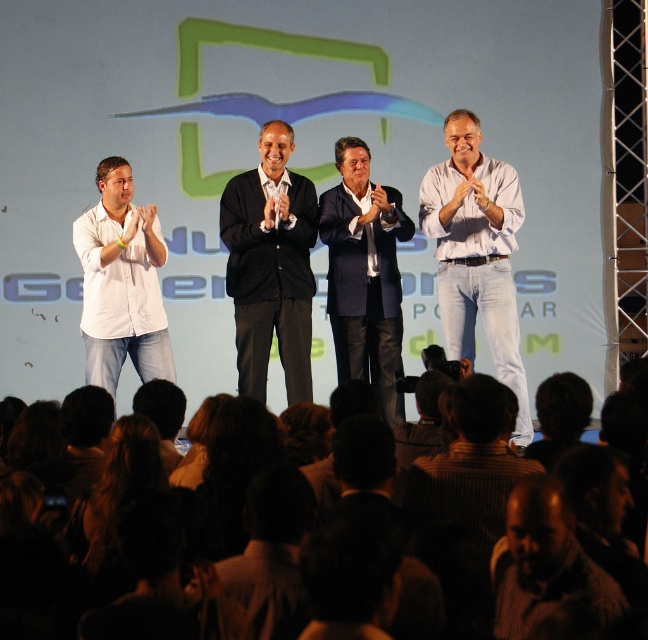
Which is above, white matte shirt at left or striped shirt at lower right?

white matte shirt at left is higher up.

Measure the distance between point (143,378) and camera.

6.16 meters

Is point (145, 324) in front of point (533, 605)?

No, it is not.

Find the location of `white matte shirt at left`. white matte shirt at left is located at coordinates (121, 282).

Does black cardigan at center have a greater height compared to white matte shirt at left?

Yes.

Based on the photo, can you confirm if black cardigan at center is positioned to the left of white matte shirt at left?

Incorrect, black cardigan at center is not on the left side of white matte shirt at left.

Is point (240, 262) positioned before point (76, 225)?

No, (240, 262) is further to viewer.

Locate an element on the screen. The width and height of the screenshot is (648, 640). black cardigan at center is located at coordinates (270, 266).

Can you confirm if navy blue suit at center is thinner than white matte shirt at left?

Yes, navy blue suit at center is thinner than white matte shirt at left.

Does navy blue suit at center appear on the left side of white matte shirt at left?

No, navy blue suit at center is not to the left of white matte shirt at left.

Identify the location of navy blue suit at center. Image resolution: width=648 pixels, height=640 pixels. (364, 275).